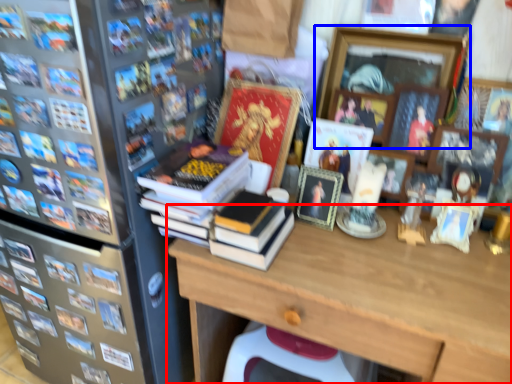
Question: Which object is further to the camera taking this photo, desk (highlighted by a red box) or picture frame (highlighted by a blue box)?

Choices:
 (A) desk
 (B) picture frame

Answer: (B)